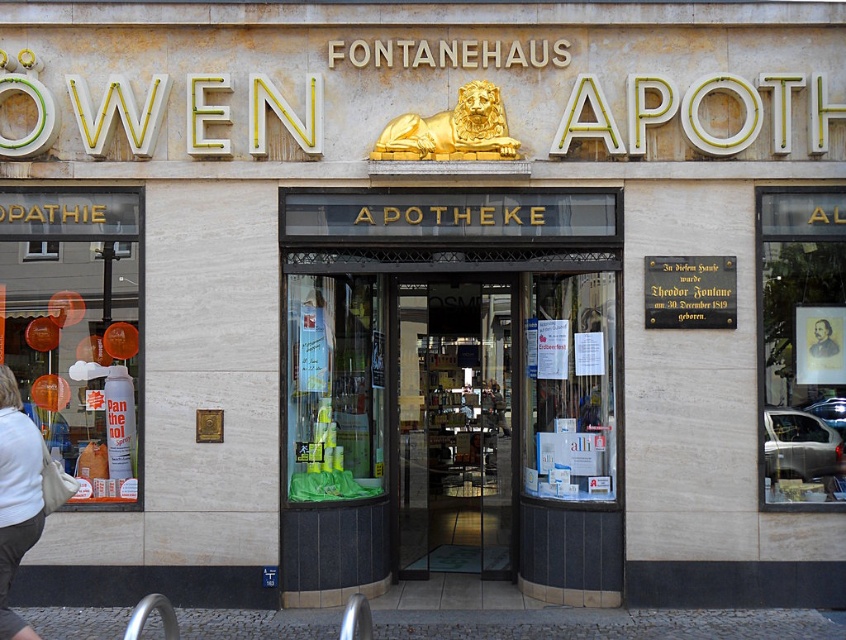
Question: Is matte glass door at center positioned in front of translucent plastic bottles at left?

Choices:
 (A) no
 (B) yes

Answer: (B)

Question: Which of the following is the farthest from the observer?

Choices:
 (A) translucent plastic bottles at left
 (B) matte glass door at center
 (C) white cotton shirt at lower left

Answer: (A)

Question: Is matte gold frame at upper right smaller than white cotton shirt at lower left?

Choices:
 (A) no
 (B) yes

Answer: (A)

Question: Which of the following is the farthest from the observer?

Choices:
 (A) (453, 408)
 (B) (797, 205)
 (C) (70, 282)

Answer: (A)

Question: Is matte glass door at center below translucent plastic bottles at left?

Choices:
 (A) no
 (B) yes

Answer: (B)

Question: Which point appears closest to the camera in this image?

Choices:
 (A) (834, 392)
 (B) (1, 449)
 (C) (97, 426)
 (D) (298, 209)

Answer: (B)